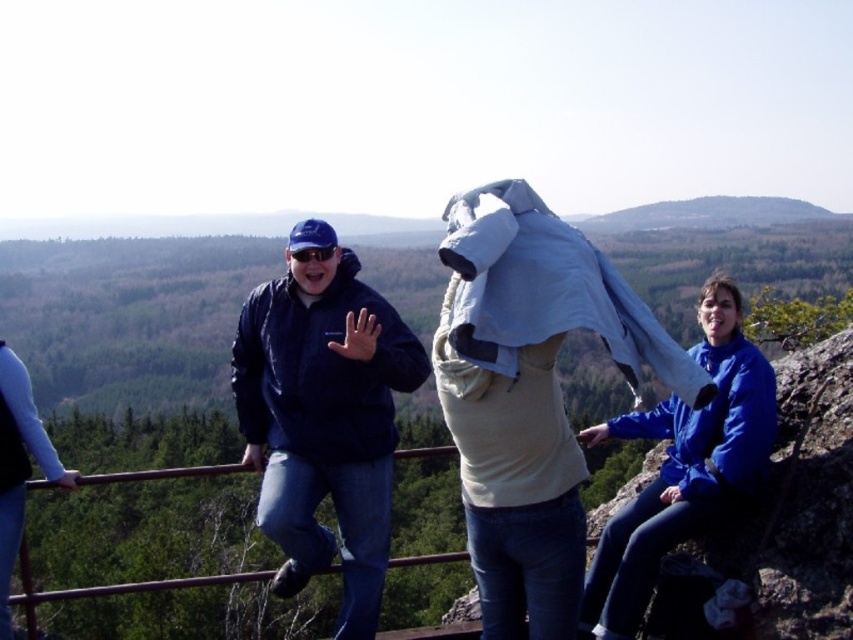
You are a photographer standing at the center of the image. You want to take a photo of the matte blue jacket at center. Where should you point your camera to capture it?

You should point your camera to the coordinates at point (323, 416) to capture the matte blue jacket at center.

You are a photographer trying to capture a photo of the two points in the scene. Which point, point (379, 557) or point (663, 417), will appear larger in the photo?

Point (379, 557) will appear larger in the photo because it is closer to the camera than point (663, 417).

You are a photographer trying to capture a group shot of the matte blue jacket at center and the blue fleece jacket at upper right. Which of the two jackets should you focus on to ensure they both fit within the camera frame if the camera has a limited horizontal field of view?

The matte blue jacket at center is wider than the blue fleece jacket at upper right, so focusing on it will ensure both fit within the frame.